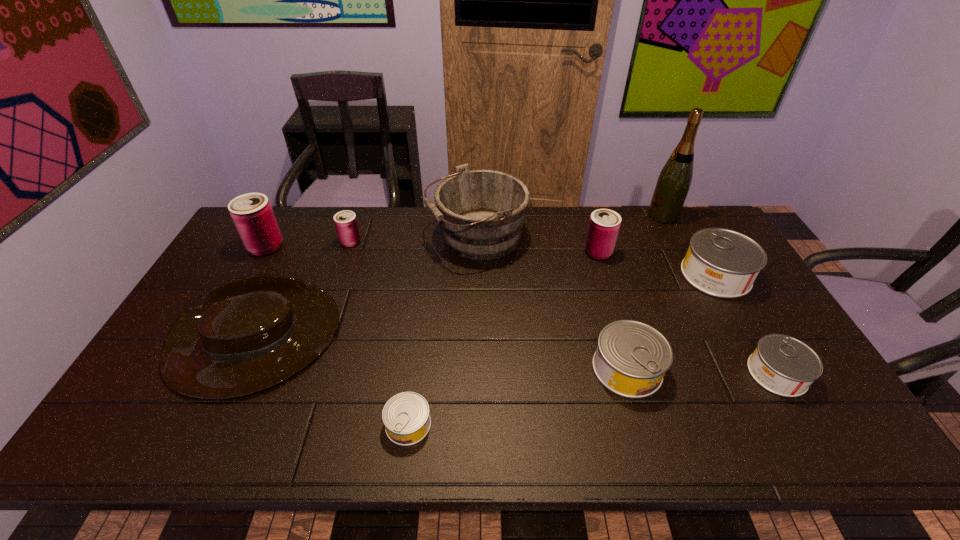
Select which can appears as the fifth closest to the third smallest silver can. Please provide its 2D coordinates. Your answer should be formatted as a tuple, i.e. [(x, y)], where the tuple contains the x and y coordinates of a point satisfying the conditions above.

[(346, 224)]

The height and width of the screenshot is (540, 960). What are the coordinates of `the fourth closest can relative to the third smallest silver can` in the screenshot? It's located at (406, 416).

At what (x,y) coordinates should I click in order to perform the action: click on pink can object that ranks as the second closest to the second biggest silver can. Please return your answer as a coordinate pair (x, y). The height and width of the screenshot is (540, 960). Looking at the image, I should click on (346, 224).

Where is `the second closest pink can relative to the leftmost pink can`? This screenshot has height=540, width=960. the second closest pink can relative to the leftmost pink can is located at coordinates (604, 224).

Find the location of a particular element. This screenshot has height=540, width=960. the closest silver can relative to the nearest object is located at coordinates (631, 359).

Identify which silver can is the second nearest to the second silver can from left to right. Please provide its 2D coordinates. Your answer should be formatted as a tuple, i.e. [(x, y)], where the tuple contains the x and y coordinates of a point satisfying the conditions above.

[(722, 263)]

Find the location of a particular element. The width and height of the screenshot is (960, 540). vacant space that satisfies the following two spatial constraints: 1. on the front side of the cowboy hat; 2. on the left side of the biggest pink can is located at coordinates (212, 343).

Image resolution: width=960 pixels, height=540 pixels. Find the location of `free space that satisfies the following two spatial constraints: 1. on the front-facing side of the second shortest object; 2. on the right side of the tallest object`. free space that satisfies the following two spatial constraints: 1. on the front-facing side of the second shortest object; 2. on the right side of the tallest object is located at coordinates (745, 374).

Find the location of `vacant area in the image that satisfies the following two spatial constraints: 1. on the front-facing side of the biggest silver can; 2. on the right side of the tallest object`. vacant area in the image that satisfies the following two spatial constraints: 1. on the front-facing side of the biggest silver can; 2. on the right side of the tallest object is located at coordinates (694, 275).